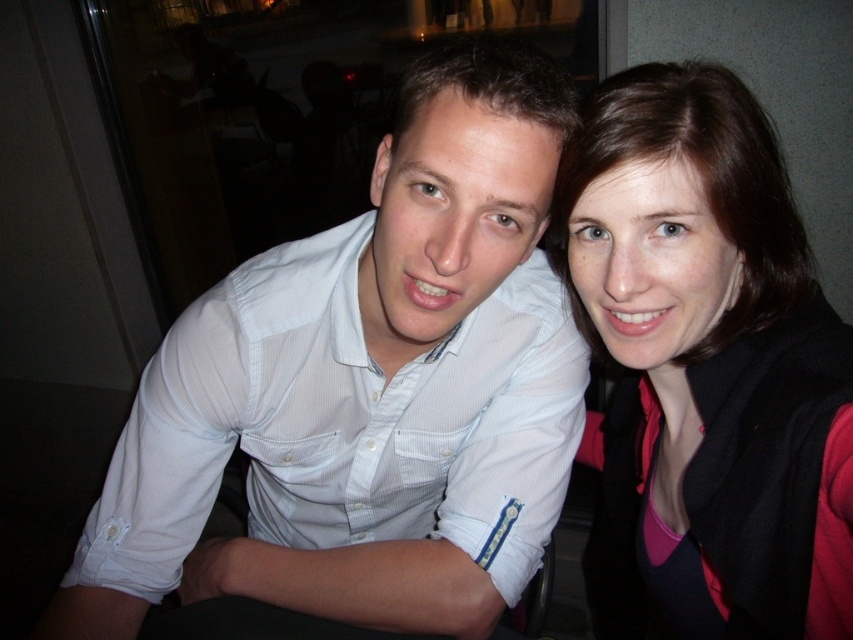
You are a photographer setting up for a group photo. You have a camera with a 50mm lens and need to ensure that both the white textured shirt at center and the matte black jacket at upper right are in focus. Given that the depth of field at this lens setting allows objects within a 10 inch range to be sharp, will both subjects be in focus?

The white textured shirt at center is 9.13 inches away from the matte black jacket at upper right. Since the depth of field allows for a 10 inch range, both objects will be within the acceptable focus range and thus in focus.